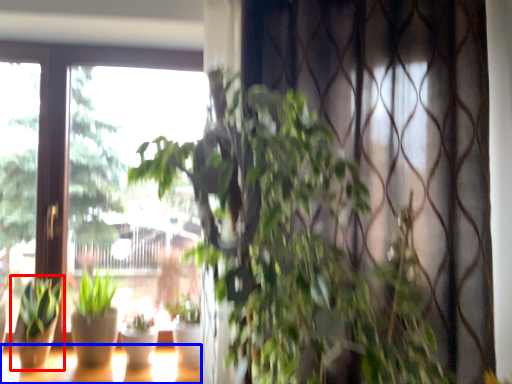
Question: Which point is further to the camera, houseplant (highlighted by a red box) or window (highlighted by a blue box)?

Choices:
 (A) houseplant
 (B) window

Answer: (A)